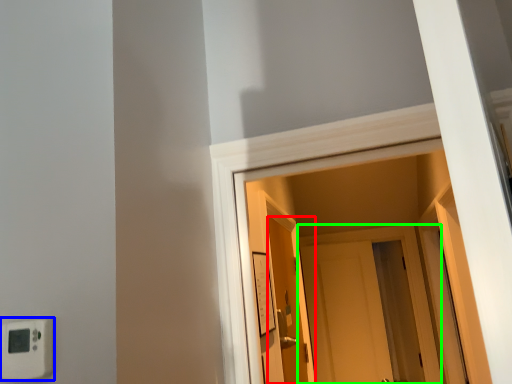
Question: Estimate the real-world distances between objects in this image. Which object is farther from door (highlighted by a red box), light switch (highlighted by a blue box) or door (highlighted by a green box)?

Choices:
 (A) light switch
 (B) door

Answer: (A)